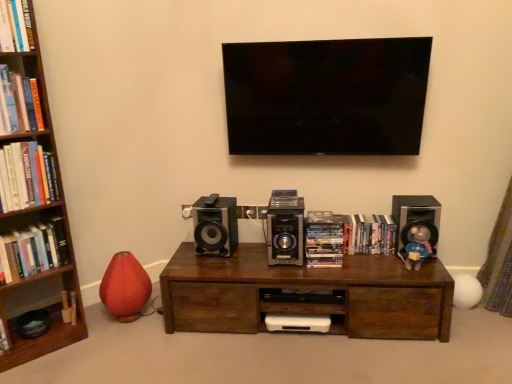
Question: Can you confirm if hardcover books at left, positioned as the fourth book in right-to-left order, is bigger than shiny plastic dvds at center, which is the fifth book from left to right?

Choices:
 (A) no
 (B) yes

Answer: (B)

Question: Is hardcover books at left, positioned as the fourth book in right-to-left order, next to shiny plastic dvds at center, the 2th book viewed from the right?

Choices:
 (A) yes
 (B) no

Answer: (B)

Question: Can you confirm if hardcover books at left, positioned as the fourth book in right-to-left order, is taller than shiny plastic dvds at center, which is the fifth book from left to right?

Choices:
 (A) no
 (B) yes

Answer: (B)

Question: From the image's perspective, does hardcover books at left, the 3th book in the left-to-right sequence, appear higher than shiny plastic dvds at center, the 2th book viewed from the right?

Choices:
 (A) no
 (B) yes

Answer: (B)

Question: Is hardcover books at left, the 3th book in the left-to-right sequence, turned away from shiny plastic dvds at center, the 2th book viewed from the right?

Choices:
 (A) yes
 (B) no

Answer: (B)

Question: In terms of size, does hardcover books at left, which appears as the 1th book when viewed from the left, appear bigger or smaller than hardcover book at upper left, the 3th book positioned from the right?

Choices:
 (A) small
 (B) big

Answer: (B)

Question: Considering their positions, is hardcover books at left, which appears as the 1th book when viewed from the left, located in front of or behind hardcover book at upper left, the 3th book positioned from the right?

Choices:
 (A) front
 (B) behind

Answer: (B)

Question: From the image's perspective, is hardcover books at left, which appears as the 6th book when viewed from the right, above or below hardcover book at upper left, the 3th book positioned from the right?

Choices:
 (A) below
 (B) above

Answer: (A)

Question: Is point (12, 249) positioned closer to the camera than point (19, 13)?

Choices:
 (A) closer
 (B) farther

Answer: (B)

Question: From the image's perspective, is wooden bookcase at left located above or below blue plush toy at right?

Choices:
 (A) above
 (B) below

Answer: (A)

Question: Does point (38, 145) appear closer or farther from the camera than point (407, 253)?

Choices:
 (A) closer
 (B) farther

Answer: (A)

Question: In the image, is wooden bookcase at left positioned in front of or behind blue plush toy at right?

Choices:
 (A) behind
 (B) front

Answer: (B)

Question: Is wooden bookcase at left spatially inside blue plush toy at right, or outside of it?

Choices:
 (A) outside
 (B) inside

Answer: (A)

Question: Looking at their shapes, would you say wooden bookcase at left is wider or thinner than shiny plastic dvds at center, which is the fifth book from left to right?

Choices:
 (A) thin
 (B) wide

Answer: (B)

Question: Choose the correct answer: Is wooden bookcase at left inside shiny plastic dvds at center, which is the fifth book from left to right, or outside it?

Choices:
 (A) outside
 (B) inside

Answer: (A)